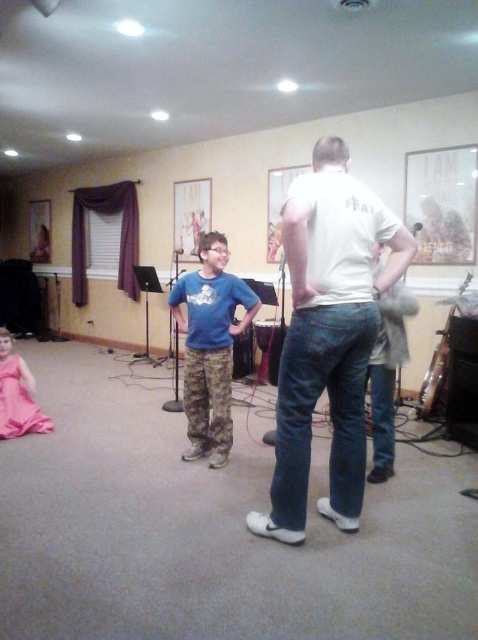
Does white matte t-shirt at center appear over pink satin dress at lower left?

Correct, white matte t-shirt at center is located above pink satin dress at lower left.

Does point (367, 257) come in front of point (0, 376)?

Yes, point (367, 257) is closer to viewer.

Identify the location of white matte t-shirt at center. (327, 337).

Does blue camouflage pants at center have a greater width compared to pink satin dress at lower left?

Yes, blue camouflage pants at center is wider than pink satin dress at lower left.

Can you confirm if blue camouflage pants at center is positioned below pink satin dress at lower left?

Incorrect, blue camouflage pants at center is not positioned below pink satin dress at lower left.

The height and width of the screenshot is (640, 478). I want to click on blue camouflage pants at center, so click(209, 346).

Image resolution: width=478 pixels, height=640 pixels. What are the coordinates of `blue camouflage pants at center` in the screenshot? It's located at (209, 346).

Is white matte t-shirt at center to the left of blue camouflage pants at center from the viewer's perspective?

No, white matte t-shirt at center is not to the left of blue camouflage pants at center.

Consider the image. Who is shorter, white matte t-shirt at center or blue camouflage pants at center?

blue camouflage pants at center is shorter.

Is point (321, 291) positioned behind point (237, 296)?

No, it is not.

At what (x,y) coordinates should I click in order to perform the action: click on white matte t-shirt at center. Please return your answer as a coordinate pair (x, y). The width and height of the screenshot is (478, 640). Looking at the image, I should click on (327, 337).